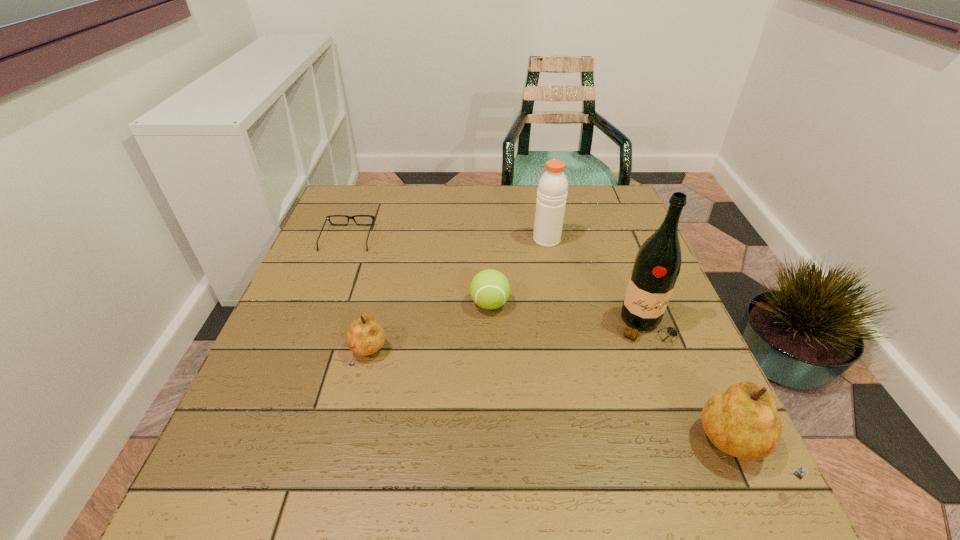
Identify the location of the farther pear. The height and width of the screenshot is (540, 960). (365, 336).

Where is `the left pear`? The width and height of the screenshot is (960, 540). the left pear is located at coordinates (365, 336).

The width and height of the screenshot is (960, 540). Identify the location of the fourth shortest object. [x=742, y=421].

The height and width of the screenshot is (540, 960). I want to click on the nearest object, so click(x=742, y=421).

Image resolution: width=960 pixels, height=540 pixels. I want to click on the fourth object from left to right, so click(552, 189).

Find the location of a particular element. the second tallest object is located at coordinates (552, 189).

What are the coordinates of `wine bottle` in the screenshot? It's located at (657, 264).

Find the location of `the shortest object`. the shortest object is located at coordinates point(328,217).

Locate an element on the screen. This screenshot has height=540, width=960. spectacles is located at coordinates (328, 217).

The width and height of the screenshot is (960, 540). I want to click on tennis ball, so click(490, 289).